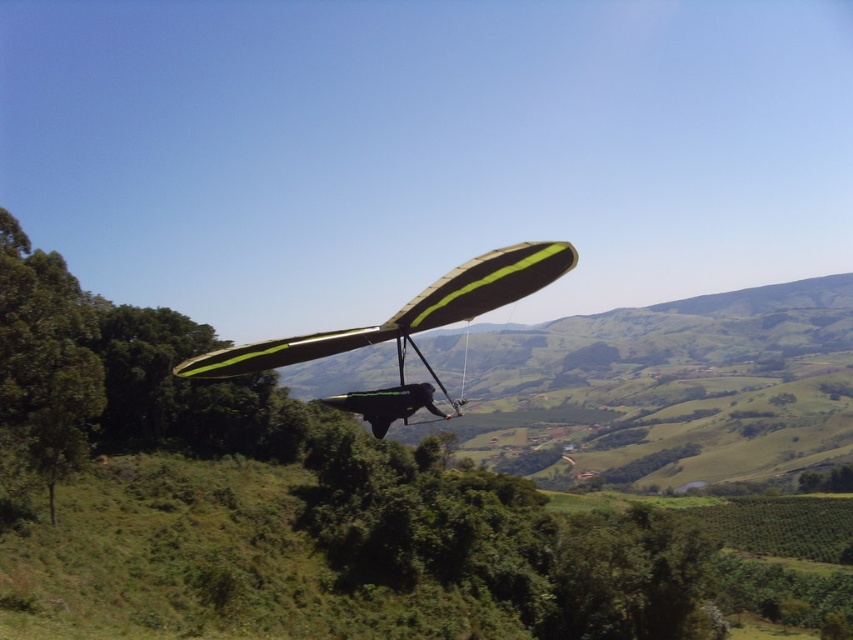
Question: Does green leafy tree at left have a larger size compared to green matte parachute at center?

Choices:
 (A) no
 (B) yes

Answer: (B)

Question: Which point is farther from the camera taking this photo?

Choices:
 (A) (548, 250)
 (B) (39, 422)

Answer: (B)

Question: Does green leafy tree at left have a larger size compared to green matte parachute at center?

Choices:
 (A) no
 (B) yes

Answer: (B)

Question: Among these points, which one is nearest to the camera?

Choices:
 (A) (65, 316)
 (B) (263, 369)

Answer: (B)

Question: Does green leafy tree at left appear under green matte parachute at center?

Choices:
 (A) no
 (B) yes

Answer: (B)